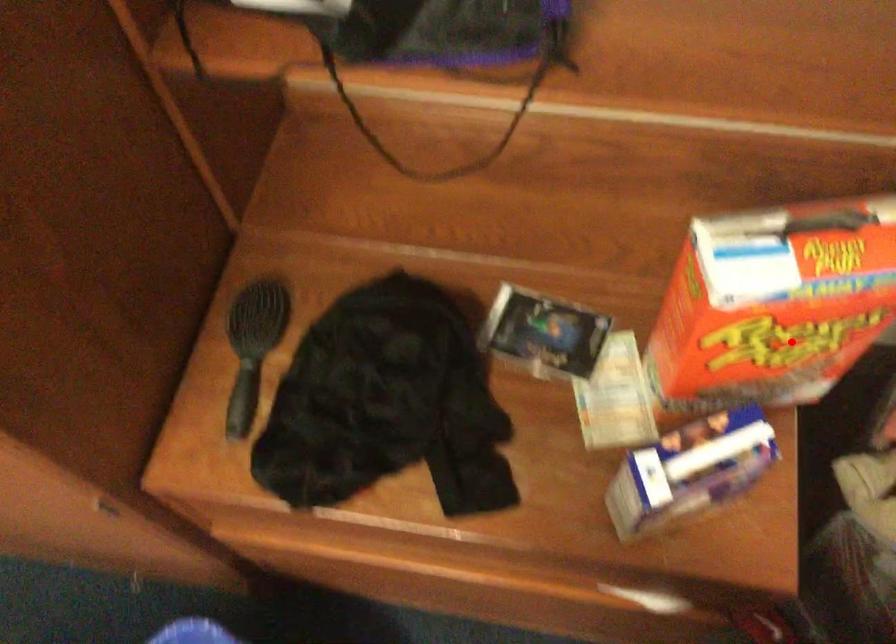
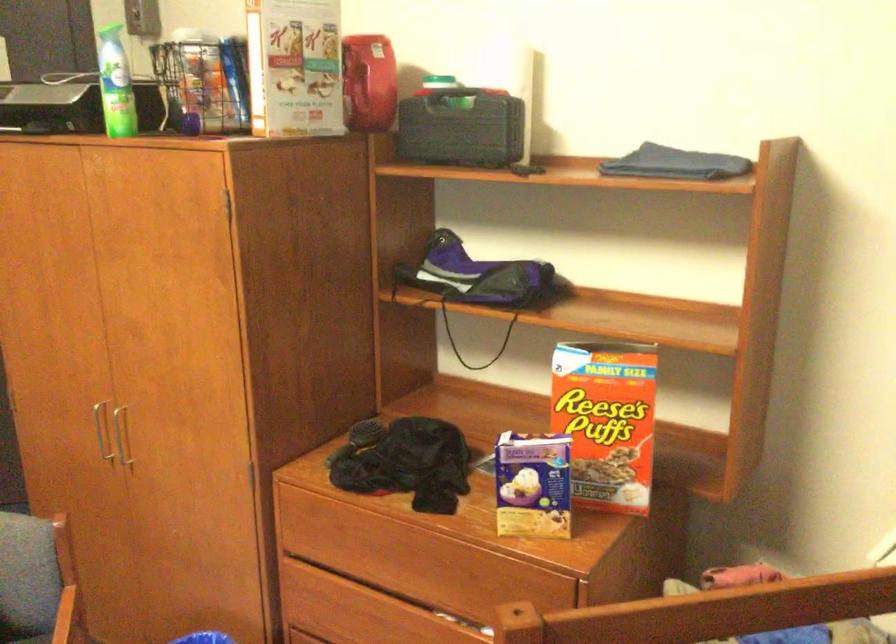
Where in the second image is the point corresponding to the highlighted location from the first image?

(606, 420)